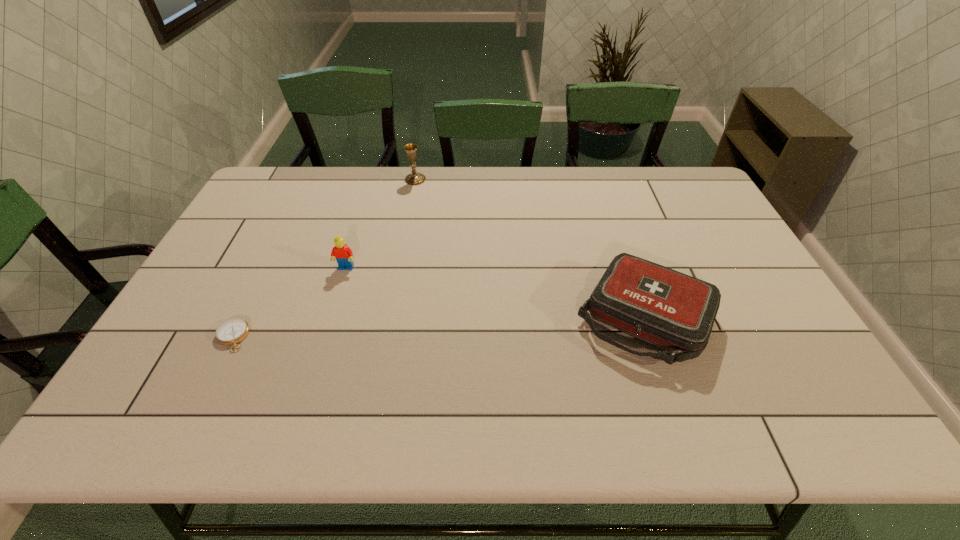
Identify the location of free space located 0.070m on the right of the leftmost object. This screenshot has height=540, width=960. (276, 337).

Locate an element on the screen. object that is at the far edge is located at coordinates (414, 178).

Where is `object that is at the left edge`? Image resolution: width=960 pixels, height=540 pixels. object that is at the left edge is located at coordinates (230, 332).

Identify the location of vacant region at the far edge. The height and width of the screenshot is (540, 960). (586, 190).

Where is `vacant space at the near edge`? The height and width of the screenshot is (540, 960). vacant space at the near edge is located at coordinates (228, 429).

In the image, there is a desktop. Identify the location of free region at the left edge. The image size is (960, 540). (244, 299).

The width and height of the screenshot is (960, 540). Find the location of `free space at the right edge`. free space at the right edge is located at coordinates (747, 313).

You are a GUI agent. You are given a task and a screenshot of the screen. Output one action in this format:
    pyautogui.click(x=<x>, y=<y>)
    Task: Click on the vacant space at the far left corner of the desktop
    This screenshot has height=540, width=960.
    Given the screenshot: What is the action you would take?
    pyautogui.click(x=268, y=186)

Find the location of a particular element. Image resolution: width=960 pixels, height=540 pixels. free space at the far right corner of the desktop is located at coordinates (679, 177).

This screenshot has height=540, width=960. I want to click on free space between the first-aid kit and the compass, so click(439, 327).